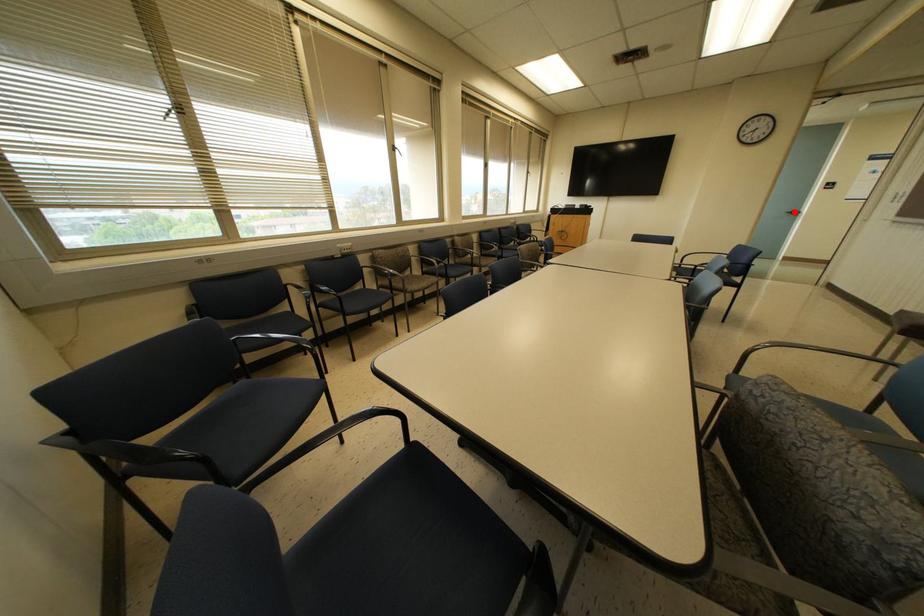
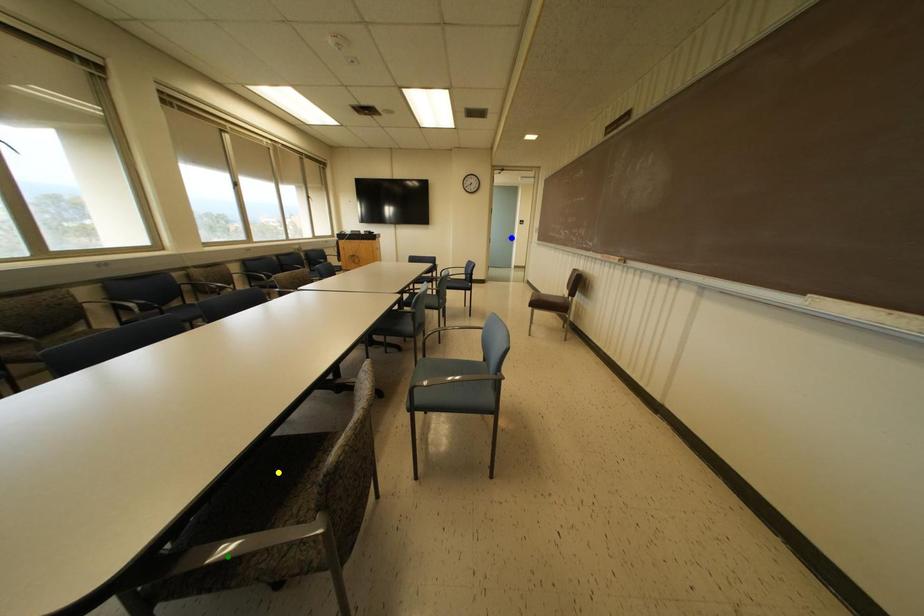
Question: I am providing you with two images of the same scene from different viewpoints. A red point is marked on the first image. You are given multiple points on the second image. Can you choose the point in image 2 that corresponds to the point in image 1?

Choices:
 (A) yellow point
 (B) blue point
 (C) green point

Answer: (B)